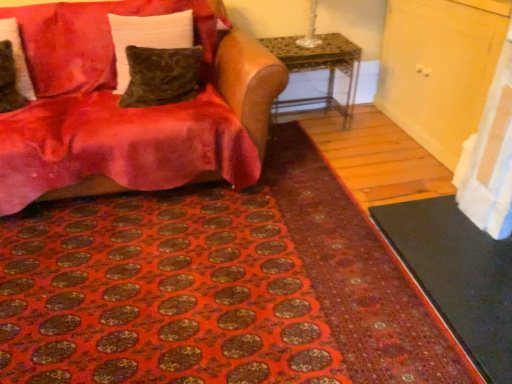
Question: Is velvet red couch at upper left completely or partially inside black rubber doormat at lower right?

Choices:
 (A) no
 (B) yes

Answer: (A)

Question: From a real-world perspective, is black rubber doormat at lower right positioned over velvet red couch at upper left based on gravity?

Choices:
 (A) yes
 (B) no

Answer: (B)

Question: From the image's perspective, does black rubber doormat at lower right appear higher than velvet red couch at upper left?

Choices:
 (A) no
 (B) yes

Answer: (A)

Question: From the image's perspective, does black rubber doormat at lower right appear lower than velvet red couch at upper left?

Choices:
 (A) yes
 (B) no

Answer: (A)

Question: Is black rubber doormat at lower right to the right of velvet red couch at upper left from the viewer's perspective?

Choices:
 (A) no
 (B) yes

Answer: (B)

Question: Does point [x=486, y=261] appear closer or farther from the camera than point [x=320, y=66]?

Choices:
 (A) closer
 (B) farther

Answer: (A)

Question: Is black rubber doormat at lower right in front of or behind metallic mosaic table at center in the image?

Choices:
 (A) front
 (B) behind

Answer: (A)

Question: From their relative heights in the image, would you say black rubber doormat at lower right is taller or shorter than metallic mosaic table at center?

Choices:
 (A) tall
 (B) short

Answer: (B)

Question: Is black rubber doormat at lower right to the left or to the right of metallic mosaic table at center in the image?

Choices:
 (A) right
 (B) left

Answer: (A)

Question: Is velvet red couch at upper left taller or shorter than velvet brown pillow at left, which ranks as the first pillow in left-to-right order?

Choices:
 (A) tall
 (B) short

Answer: (A)

Question: Relative to velvet brown pillow at left, the third pillow in the right-to-left sequence, is velvet red couch at upper left in front or behind?

Choices:
 (A) front
 (B) behind

Answer: (A)

Question: Is velvet red couch at upper left to the left or to the right of velvet brown pillow at left, the third pillow in the right-to-left sequence, in the image?

Choices:
 (A) left
 (B) right

Answer: (B)

Question: From a real-world perspective, relative to velvet brown pillow at left, which ranks as the first pillow in left-to-right order, is velvet red couch at upper left vertically above or below?

Choices:
 (A) below
 (B) above

Answer: (A)

Question: Considering the positions of velvet green pillow at upper left, which appears as the second pillow when viewed from the right, and metallic mosaic table at center in the image, is velvet green pillow at upper left, which appears as the second pillow when viewed from the right, bigger or smaller than metallic mosaic table at center?

Choices:
 (A) small
 (B) big

Answer: (A)

Question: In terms of width, does velvet green pillow at upper left, the 2th pillow from the left, look wider or thinner when compared to metallic mosaic table at center?

Choices:
 (A) thin
 (B) wide

Answer: (A)